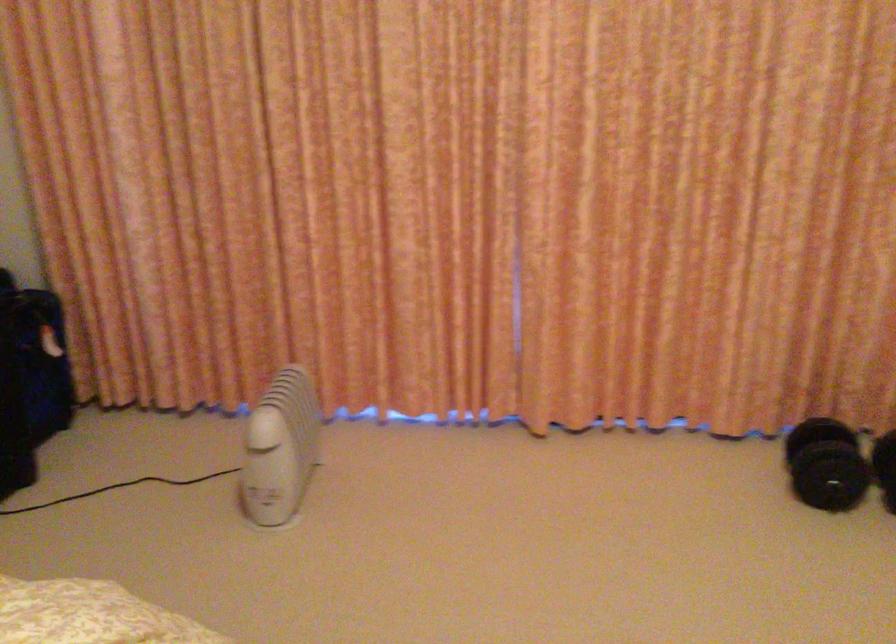
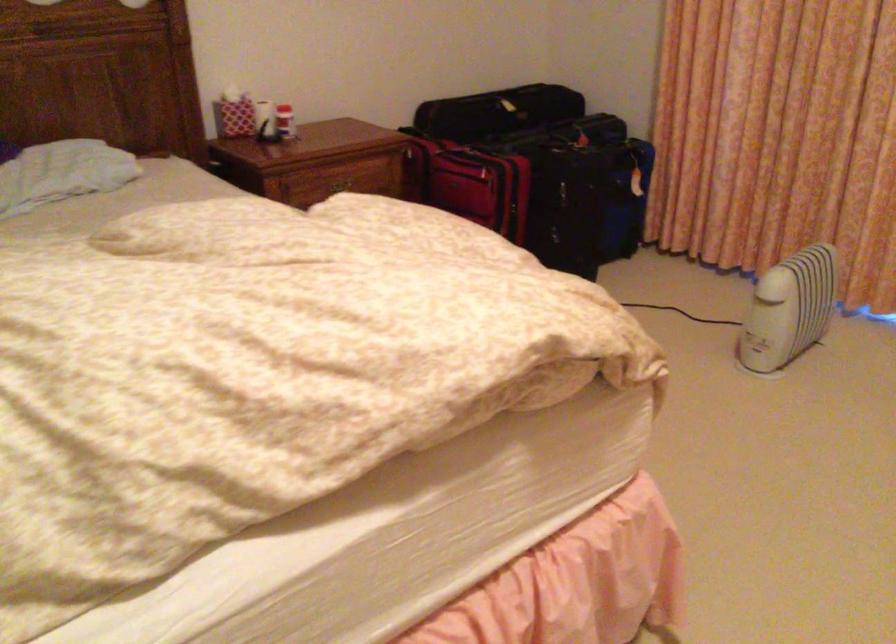
The point at (83,384) is marked in the first image. Where is the corresponding point in the second image?

(649, 223)